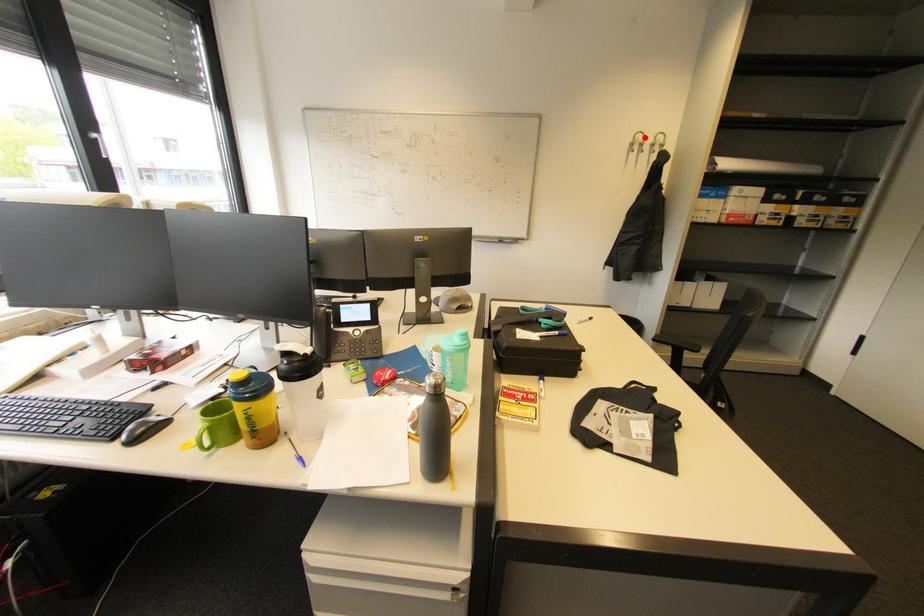
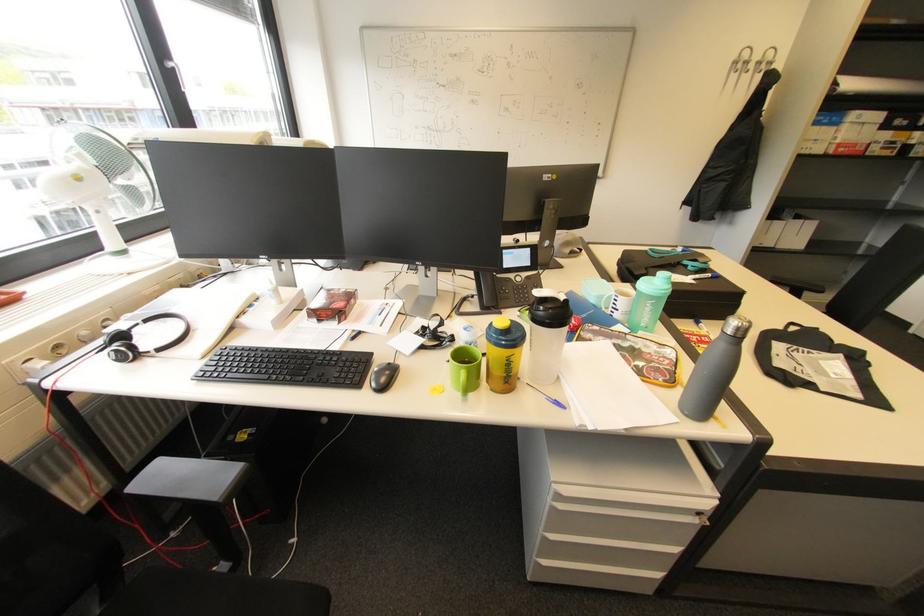
Question: I am providing you with two images of the same scene from different viewpoints. Image1 has a red point marked. In image2, the corresponding 3D location appears at what relative position? Reply with the corresponding letter.

Choices:
 (A) Closer
 (B) Farther

Answer: (B)